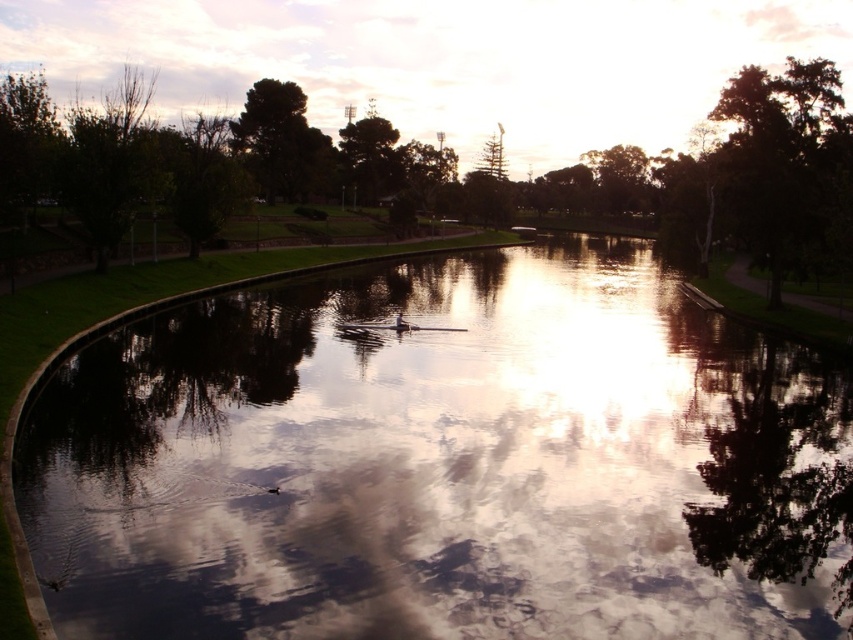
Is glossy reflective water at center taller than green leafy tree at center?

No.

Does point (567, 580) come behind point (184, 131)?

No, it is not.

From the picture: Measure the distance between glossy reflective water at center and camera.

glossy reflective water at center is 34.13 feet away from camera.

Locate an element on the screen. glossy reflective water at center is located at coordinates (444, 464).

Who is positioned more to the left, glossy reflective water at center or green leafy tree at upper right?

glossy reflective water at center

Who is more forward, [74,499] or [743,97]?

Point [74,499]

Between point (540, 264) and point (769, 90), which one is positioned behind?

The point (540, 264) is more distant.

Find the location of a particular element. This screenshot has height=640, width=853. glossy reflective water at center is located at coordinates (444, 464).

Between green leafy tree at center and green leafy tree at upper right, which one has less height?

With less height is green leafy tree at upper right.

Who is more distant from viewer, (500, 156) or (824, 228)?

Positioned behind is point (500, 156).

Image resolution: width=853 pixels, height=640 pixels. I want to click on green leafy tree at center, so click(607, 170).